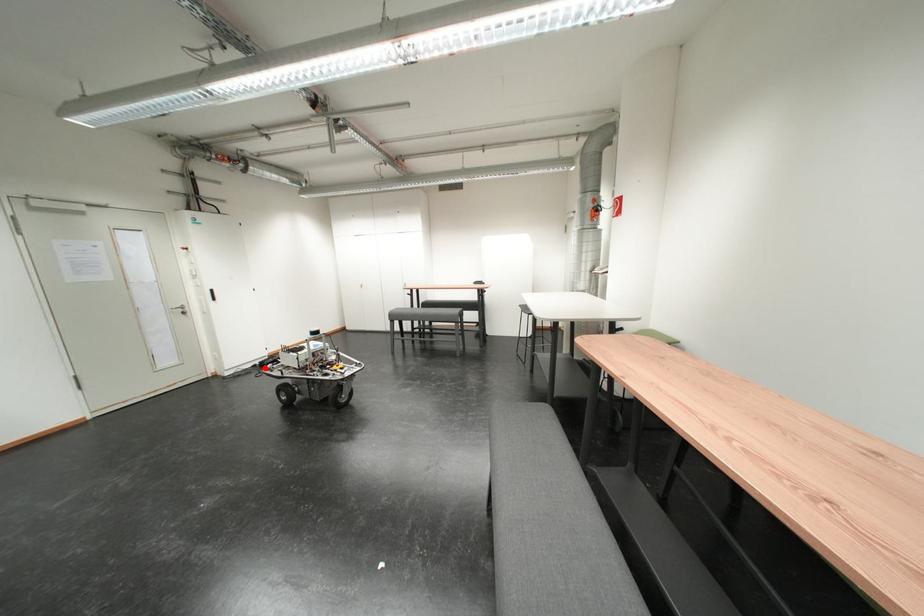
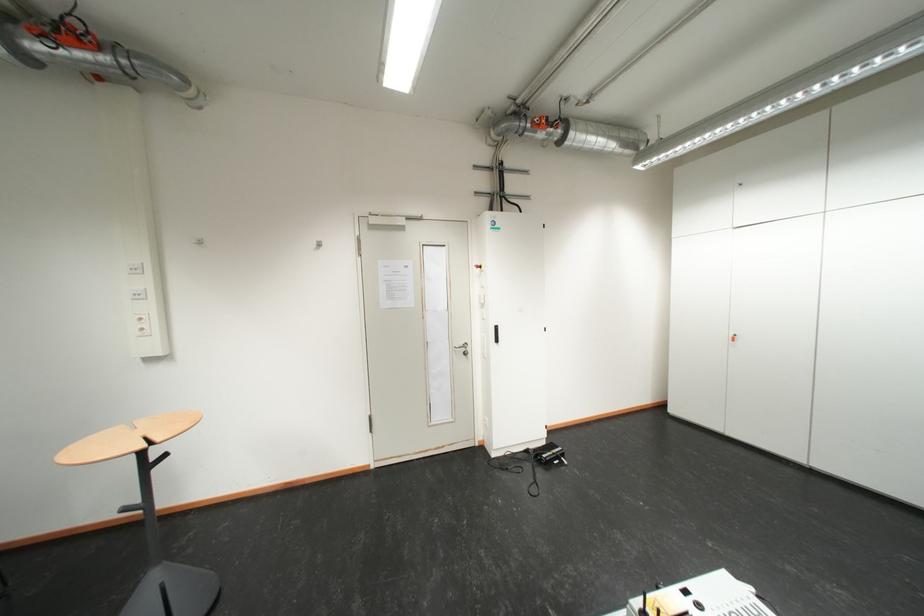
Question: A red point is marked in image1. In image2, is the corresponding 3D point closer to the camera or farther? Reply with the corresponding letter.

Choices:
 (A) The corresponding 3D point is closer.
 (B) The corresponding 3D point is farther.

Answer: (A)